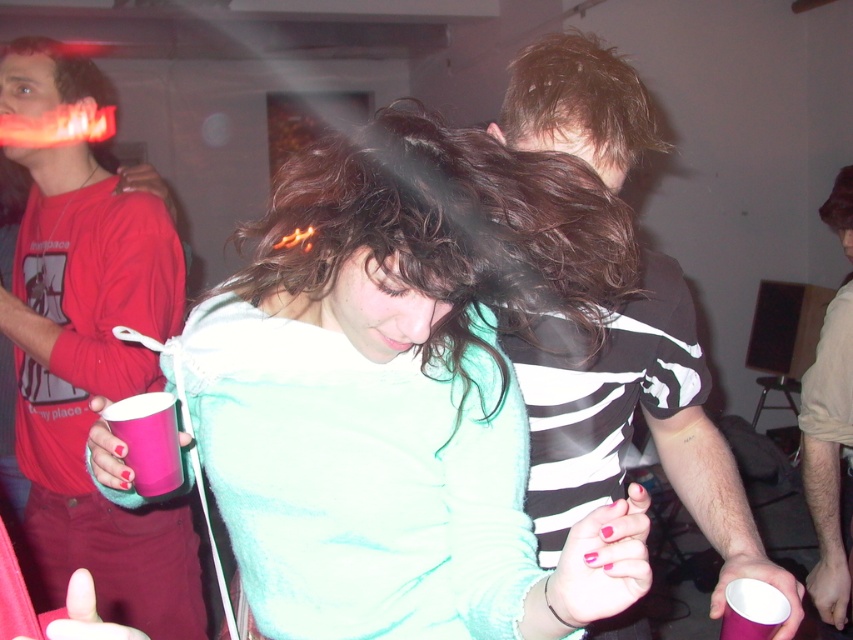
Question: Does teal soft towel at center lie behind matte red shirt at left?

Choices:
 (A) no
 (B) yes

Answer: (A)

Question: Among these points, which one is farthest from the camera?

Choices:
 (A) (164, 452)
 (B) (413, 230)
 (C) (809, 481)

Answer: (C)

Question: Which of these objects is positioned farthest from the matte red shirt at left?

Choices:
 (A) pink paper cup at lower right
 (B) teal soft towel at center
 (C) brown fuzzy hat at upper center

Answer: (C)

Question: Based on their relative distances, which object is nearer to the striped cotton shirt at center?

Choices:
 (A) brown fuzzy hat at upper center
 (B) pink plastic cup at lower left

Answer: (B)

Question: Can you confirm if pink plastic cup at lower left is wider than pink paper cup at lower right?

Choices:
 (A) yes
 (B) no

Answer: (A)

Question: Where is teal soft towel at center located in relation to striped cotton shirt at center in the image?

Choices:
 (A) above
 (B) below

Answer: (B)